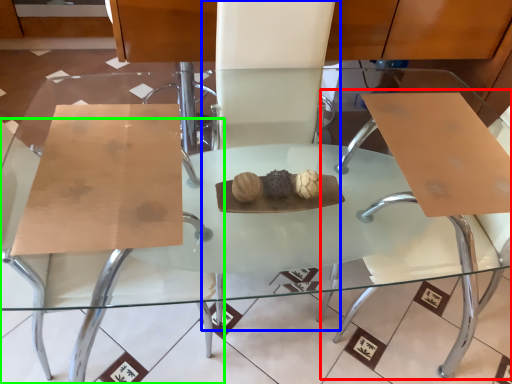
Question: Estimate the real-world distances between objects in this image. Which object is closer to swivel chair (highlighted by a red box), chair (highlighted by a blue box) or chair (highlighted by a green box)?

Choices:
 (A) chair
 (B) chair

Answer: (A)